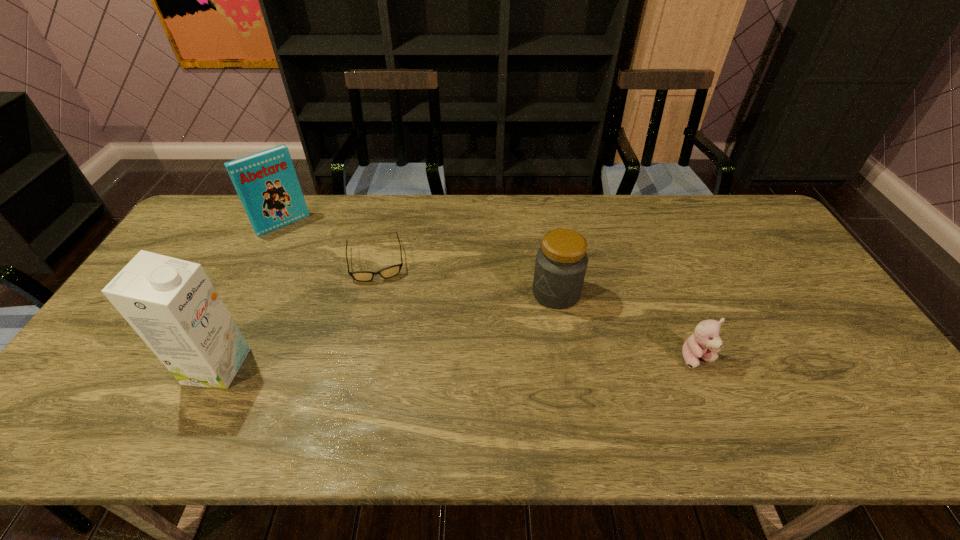
Identify the location of vacant area that lies between the rightmost object and the second tallest object. The image size is (960, 540). (491, 291).

What are the coordinates of `free space between the farthest object and the sunglasses` in the screenshot? It's located at (329, 242).

Locate an element on the screen. Image resolution: width=960 pixels, height=540 pixels. free space between the sunglasses and the fourth object from left to right is located at coordinates (466, 276).

The image size is (960, 540). I want to click on vacant area that lies between the shortest object and the tallest object, so coord(297,313).

I want to click on vacant area that lies between the book and the jar, so click(420, 259).

The image size is (960, 540). I want to click on vacant area that lies between the farthest object and the third object from right to left, so click(329, 242).

Select which object appears as the fourth closest to the farthest object. Please provide its 2D coordinates. Your answer should be formatted as a tuple, i.e. [(x, y)], where the tuple contains the x and y coordinates of a point satisfying the conditions above.

[(705, 342)]

Locate which object is the second closest to the third object from left to right. Please provide its 2D coordinates. Your answer should be formatted as a tuple, i.e. [(x, y)], where the tuple contains the x and y coordinates of a point satisfying the conditions above.

[(172, 305)]

Locate an element on the screen. The height and width of the screenshot is (540, 960). free spot that satisfies the following two spatial constraints: 1. on the front side of the sunglasses; 2. on the right side of the fourth object from left to right is located at coordinates (368, 293).